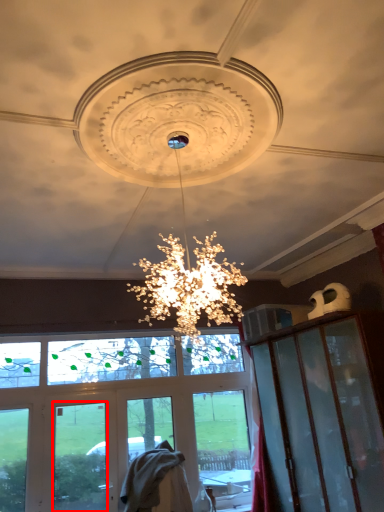
Question: Considering the relative positions of glass window (annotated by the red box) and window screen in the image provided, where is glass window (annotated by the red box) located with respect to the staircase?

Choices:
 (A) left
 (B) right

Answer: (A)